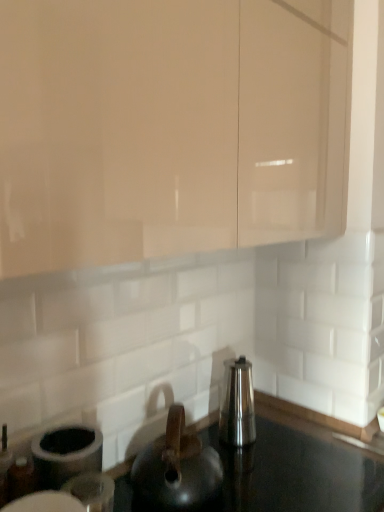
Question: From a real-world perspective, is satin silver kettle at center on top of black glossy countertop at center?

Choices:
 (A) yes
 (B) no

Answer: (A)

Question: Is satin silver kettle at center facing away from black glossy countertop at center?

Choices:
 (A) yes
 (B) no

Answer: (B)

Question: From a real-world perspective, is satin silver kettle at center beneath black glossy countertop at center?

Choices:
 (A) no
 (B) yes

Answer: (A)

Question: From the image's perspective, would you say satin silver kettle at center is shown under black glossy countertop at center?

Choices:
 (A) no
 (B) yes

Answer: (A)

Question: Considering the relative positions of satin silver kettle at center and black glossy countertop at center in the image provided, is satin silver kettle at center behind black glossy countertop at center?

Choices:
 (A) no
 (B) yes

Answer: (B)

Question: In terms of size, does matte beige cabinet at upper center appear bigger or smaller than satin silver kettle at center?

Choices:
 (A) small
 (B) big

Answer: (B)

Question: Does point (147, 188) appear closer or farther from the camera than point (225, 385)?

Choices:
 (A) farther
 (B) closer

Answer: (B)

Question: Is matte beige cabinet at upper center wider or thinner than satin silver kettle at center?

Choices:
 (A) wide
 (B) thin

Answer: (A)

Question: Is matte beige cabinet at upper center taller or shorter than satin silver kettle at center?

Choices:
 (A) short
 (B) tall

Answer: (B)

Question: From the image's perspective, is matte beige cabinet at upper center located above or below black glossy countertop at center?

Choices:
 (A) below
 (B) above

Answer: (B)

Question: Considering the positions of matte beige cabinet at upper center and black glossy countertop at center in the image, is matte beige cabinet at upper center wider or thinner than black glossy countertop at center?

Choices:
 (A) thin
 (B) wide

Answer: (A)

Question: Based on their sizes in the image, would you say matte beige cabinet at upper center is bigger or smaller than black glossy countertop at center?

Choices:
 (A) big
 (B) small

Answer: (A)

Question: Is matte beige cabinet at upper center to the left or to the right of black glossy countertop at center in the image?

Choices:
 (A) right
 (B) left

Answer: (B)

Question: Do you think matte black kettle at center is within matte beige cabinet at upper center, or outside of it?

Choices:
 (A) inside
 (B) outside

Answer: (B)

Question: From a real-world perspective, is matte black kettle at center physically located above or below matte beige cabinet at upper center?

Choices:
 (A) above
 (B) below

Answer: (B)